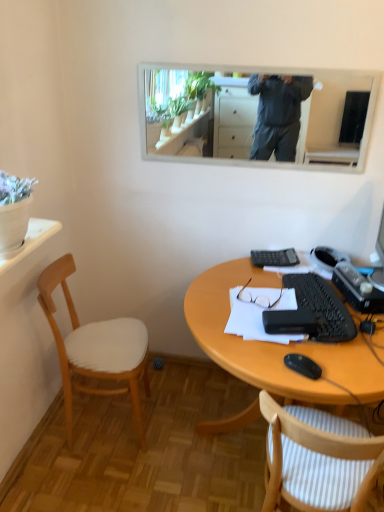
This screenshot has height=512, width=384. I want to click on vacant space in wooden chair with white cushion at left, which is counted as the 1th chair, starting from the left (from a real-world perspective), so click(x=104, y=420).